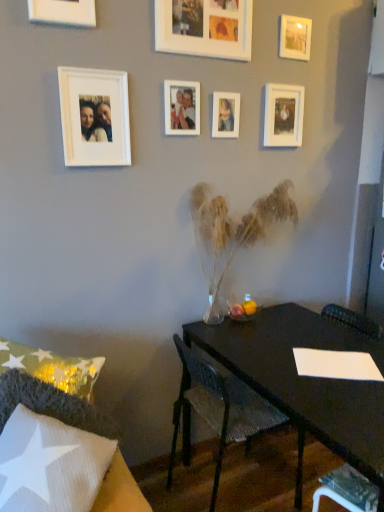
Question: Is there a large distance between white fabric chair at lower left, which appears as the first chair when viewed from the left, and matte white photo frame at center, the 5th picture frame when ordered from left to right?

Choices:
 (A) no
 (B) yes

Answer: (B)

Question: Is white fabric chair at lower left, which appears as the first chair when viewed from the left, at the right side of matte white photo frame at center, the 5th picture frame when ordered from left to right?

Choices:
 (A) yes
 (B) no

Answer: (B)

Question: Does white fabric chair at lower left, marked as the 2th chair in a back-to-front arrangement, have a smaller size compared to matte white photo frame at center, the third picture frame positioned from the right?

Choices:
 (A) no
 (B) yes

Answer: (A)

Question: Can you confirm if white fabric chair at lower left, which appears as the first chair when viewed from the left, is bigger than matte white photo frame at center, the 5th picture frame when ordered from left to right?

Choices:
 (A) yes
 (B) no

Answer: (A)

Question: Is white fabric chair at lower left, marked as the 2th chair in a back-to-front arrangement, shorter than matte white photo frame at center, the 5th picture frame when ordered from left to right?

Choices:
 (A) no
 (B) yes

Answer: (A)

Question: Is white fabric chair at lower left, the first chair when ordered from front to back, at the left side of matte white photo frame at center, the third picture frame positioned from the right?

Choices:
 (A) no
 (B) yes

Answer: (B)

Question: From a real-world perspective, is white paper at lower right under matte white photo frame at center, the third picture frame positioned from the right?

Choices:
 (A) yes
 (B) no

Answer: (A)

Question: Is white paper at lower right facing away from matte white photo frame at center, the third picture frame positioned from the right?

Choices:
 (A) yes
 (B) no

Answer: (B)

Question: From the image's perspective, does white paper at lower right appear lower than matte white photo frame at center, the 5th picture frame when ordered from left to right?

Choices:
 (A) yes
 (B) no

Answer: (A)

Question: Is white paper at lower right not within matte white photo frame at center, the third picture frame positioned from the right?

Choices:
 (A) yes
 (B) no

Answer: (A)

Question: Does white paper at lower right have a greater width compared to matte white photo frame at center, the third picture frame positioned from the right?

Choices:
 (A) no
 (B) yes

Answer: (B)

Question: Considering the relative sizes of white paper at lower right and matte white photo frame at center, the 5th picture frame when ordered from left to right, in the image provided, is white paper at lower right thinner than matte white photo frame at center, the 5th picture frame when ordered from left to right,?

Choices:
 (A) no
 (B) yes

Answer: (A)

Question: From a real-world perspective, does white fabric chair at lower left, which appears as the first chair when viewed from the left, sit lower than white paper at lower right?

Choices:
 (A) yes
 (B) no

Answer: (B)